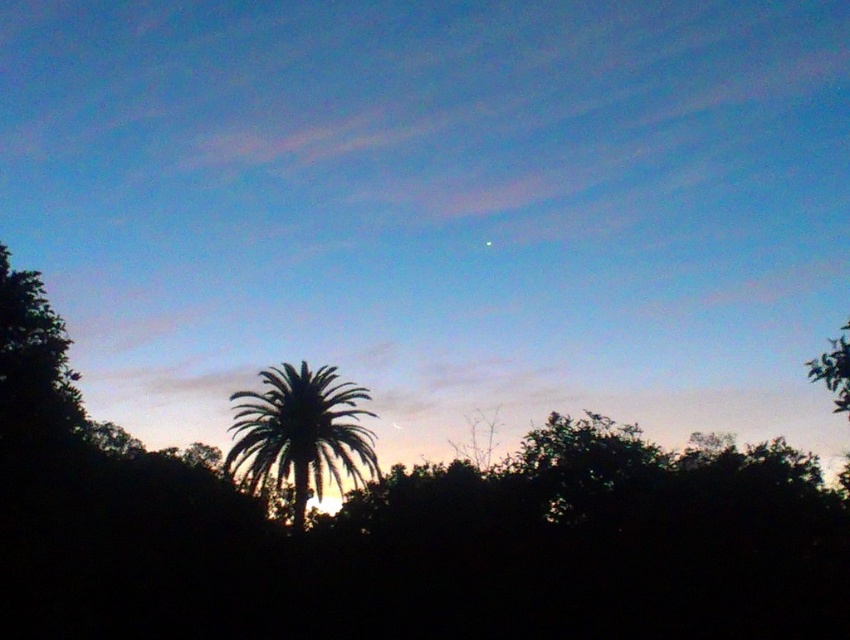
You are standing in the twilight scene and want to move from the point at coordinates point (558,612) to the point at coordinates point (332,460). Will you have to go through the palm tree silhouette in the center?

Point point (558,612) is in front of point point (332,460), so moving from point point (558,612) to point point (332,460) would require moving towards the palm tree silhouette in the center, but since point point (558,612) is already in front, you won not have to go through the palm tree.

From the picture: You are a photographer trying to capture the silhouette leafy tree at center. You want to position your camera at a specific coordinate to ensure the tree is centered in your shot. What are the coordinates you should aim for?

The silhouette leafy tree at center is located at point (x=398, y=532), so you should aim your camera at those coordinates to center the tree in your shot.

You are an artist sketching the twilight scene. You need to place the silhouette leafy tree at center and the silhouette leafy palm at center correctly. According to the scene description, which one is positioned to the left?

The silhouette leafy tree at center is positioned to the left of the silhouette leafy palm at center.